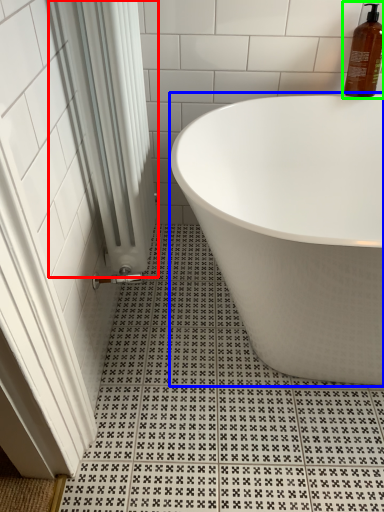
Question: Which is farther away from shower curtain (highlighted by a red box)? bathtub (highlighted by a blue box) or cleaning product (highlighted by a green box)?

Choices:
 (A) bathtub
 (B) cleaning product

Answer: (B)